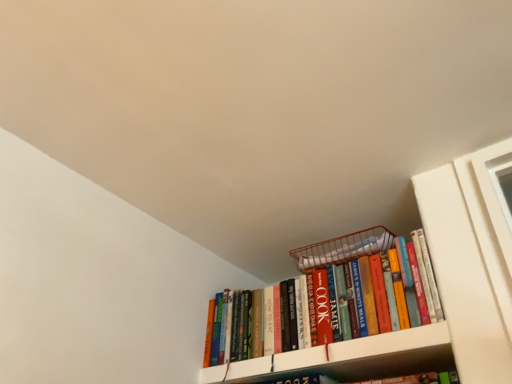
The image size is (512, 384). I want to click on hardcover books at upper right, so click(337, 277).

What do you see at coordinates (337, 277) in the screenshot? The width and height of the screenshot is (512, 384). I see `hardcover books at upper right` at bounding box center [337, 277].

The height and width of the screenshot is (384, 512). I want to click on white matte bookshelf at upper right, so click(357, 358).

What is the approximate width of white matte bookshelf at upper right?

It is 53.90 centimeters.

Measure the distance between white matte bookshelf at upper right and camera.

3.64 feet.

This screenshot has width=512, height=384. What do you see at coordinates (357, 358) in the screenshot?
I see `white matte bookshelf at upper right` at bounding box center [357, 358].

The height and width of the screenshot is (384, 512). I want to click on hardcover books at upper right, so click(337, 277).

Which is more to the right, white matte bookshelf at upper right or hardcover books at upper right?

white matte bookshelf at upper right is more to the right.

Does white matte bookshelf at upper right lie in front of hardcover books at upper right?

Yes, white matte bookshelf at upper right is in front of hardcover books at upper right.

Between point (292, 355) and point (327, 312), which one is positioned in front?

Point (292, 355)

From the image's perspective, would you say white matte bookshelf at upper right is shown under hardcover books at upper right?

Correct, white matte bookshelf at upper right appears lower than hardcover books at upper right in the image.

From a real-world perspective, is white matte bookshelf at upper right located beneath hardcover books at upper right?

Yes, from a real-world perspective, white matte bookshelf at upper right is beneath hardcover books at upper right.

In terms of width, does white matte bookshelf at upper right look wider or thinner when compared to hardcover books at upper right?

Clearly, white matte bookshelf at upper right has more width compared to hardcover books at upper right.

Is white matte bookshelf at upper right taller than hardcover books at upper right?

No, white matte bookshelf at upper right is not taller than hardcover books at upper right.

Is white matte bookshelf at upper right smaller than hardcover books at upper right?

Indeed, white matte bookshelf at upper right has a smaller size compared to hardcover books at upper right.

Based on the photo, is white matte bookshelf at upper right outside of hardcover books at upper right?

Indeed, white matte bookshelf at upper right is completely outside hardcover books at upper right.

Is white matte bookshelf at upper right next to hardcover books at upper right?

No, white matte bookshelf at upper right is not in contact with hardcover books at upper right.

Based on the photo, does white matte bookshelf at upper right turn towards hardcover books at upper right?

No, white matte bookshelf at upper right is not aimed at hardcover books at upper right.

Measure the distance from white matte bookshelf at upper right to hardcover books at upper right.

white matte bookshelf at upper right and hardcover books at upper right are 4.98 inches apart from each other.

Identify the location of book that is above the white matte bookshelf at upper right (from the image's perspective). (337, 277).

From the picture: Which object is positioned more to the right, hardcover books at upper right or white matte bookshelf at upper right?

Positioned to the right is white matte bookshelf at upper right.

Considering their positions, is hardcover books at upper right located in front of or behind white matte bookshelf at upper right?

In the image, hardcover books at upper right appears behind white matte bookshelf at upper right.

Is point (287, 311) closer or farther from the camera than point (392, 362)?

Point (287, 311) is farther from the camera than point (392, 362).

From the image's perspective, is hardcover books at upper right located beneath white matte bookshelf at upper right?

No.

From a real-world perspective, relative to white matte bookshelf at upper right, is hardcover books at upper right vertically above or below?

In terms of real-world spatial position, hardcover books at upper right is above white matte bookshelf at upper right.

Considering the sizes of objects hardcover books at upper right and white matte bookshelf at upper right in the image provided, who is thinner, hardcover books at upper right or white matte bookshelf at upper right?

hardcover books at upper right is thinner.

Considering the relative sizes of hardcover books at upper right and white matte bookshelf at upper right in the image provided, is hardcover books at upper right shorter than white matte bookshelf at upper right?

No, hardcover books at upper right is not shorter than white matte bookshelf at upper right.

In terms of size, does hardcover books at upper right appear bigger or smaller than white matte bookshelf at upper right?

Clearly, hardcover books at upper right is larger in size than white matte bookshelf at upper right.

From the picture: Is hardcover books at upper right inside or outside of white matte bookshelf at upper right?

hardcover books at upper right is not enclosed by white matte bookshelf at upper right.

Would you say hardcover books at upper right is a long distance from white matte bookshelf at upper right?

No, there isn't a large distance between hardcover books at upper right and white matte bookshelf at upper right.

Is hardcover books at upper right facing away from white matte bookshelf at upper right?

No, hardcover books at upper right is not facing away from white matte bookshelf at upper right.

How distant is hardcover books at upper right from white matte bookshelf at upper right?

hardcover books at upper right is 4.98 inches away from white matte bookshelf at upper right.

This screenshot has height=384, width=512. Identify the location of book behind the white matte bookshelf at upper right. (337, 277).

At what (x,y) coordinates should I click in order to perform the action: click on cabinet in front of the hardcover books at upper right. Please return your answer as a coordinate pair (x, y). Looking at the image, I should click on (357, 358).

In the image, there is a hardcover books at upper right. Where is `cabinet below it (from the image's perspective)`? The width and height of the screenshot is (512, 384). cabinet below it (from the image's perspective) is located at coordinates 357,358.